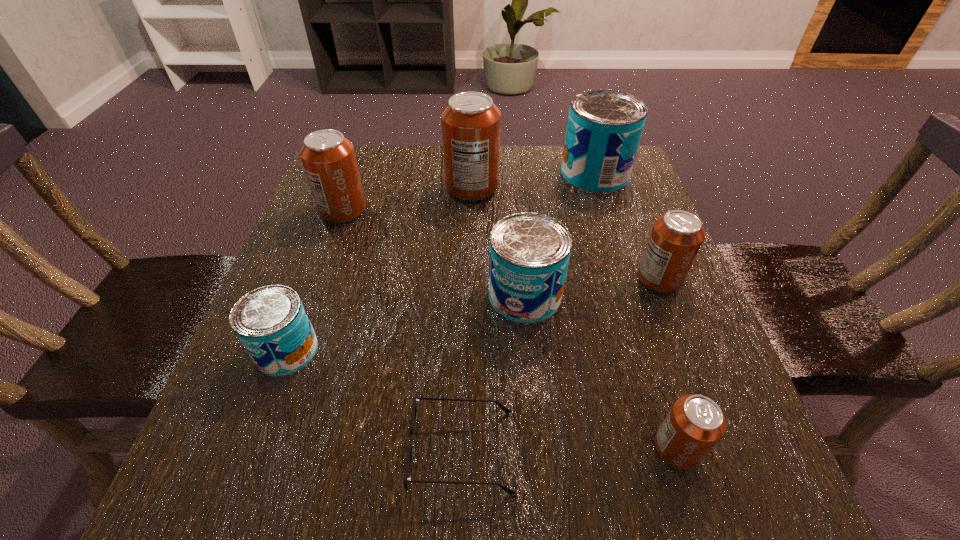
The image size is (960, 540). In order to click on the tallest can in this screenshot , I will do `click(470, 122)`.

Find the location of `the tallest object`. the tallest object is located at coordinates (470, 122).

The width and height of the screenshot is (960, 540). I want to click on the farthest blue can, so click(604, 128).

In order to click on the rightmost blue can in this screenshot , I will do `click(604, 128)`.

Locate an element on the screen. the leftmost orange can is located at coordinates (328, 158).

Locate an element on the screen. the second farthest blue can is located at coordinates (529, 255).

Where is `the second blue can from right to left`? the second blue can from right to left is located at coordinates (529, 255).

Find the location of a particular element. This screenshot has width=960, height=540. the second nearest orange can is located at coordinates (676, 237).

At what (x,y) coordinates should I click in order to perform the action: click on the nearest can. Please return your answer as a coordinate pair (x, y). Looking at the image, I should click on [x=694, y=425].

I want to click on the smallest orange can, so click(694, 425).